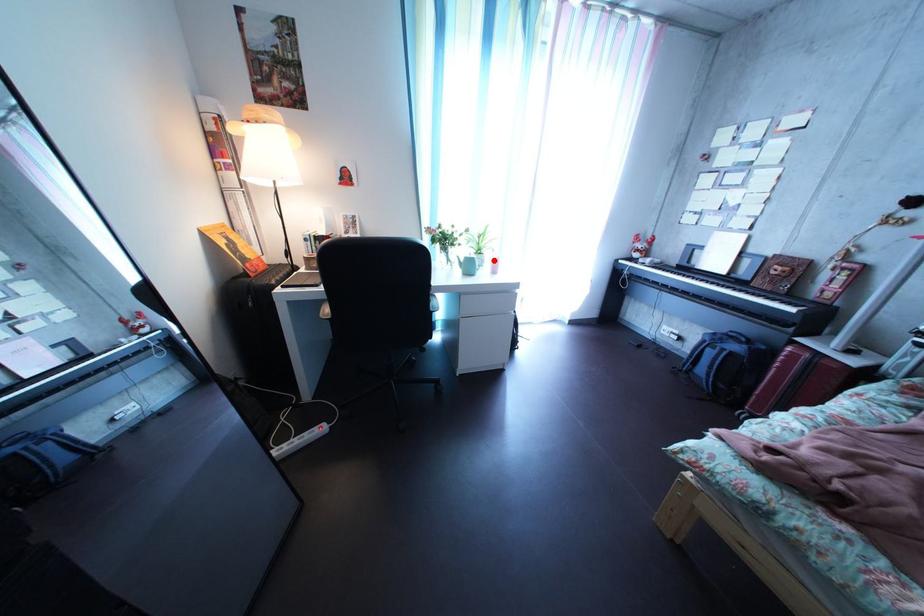
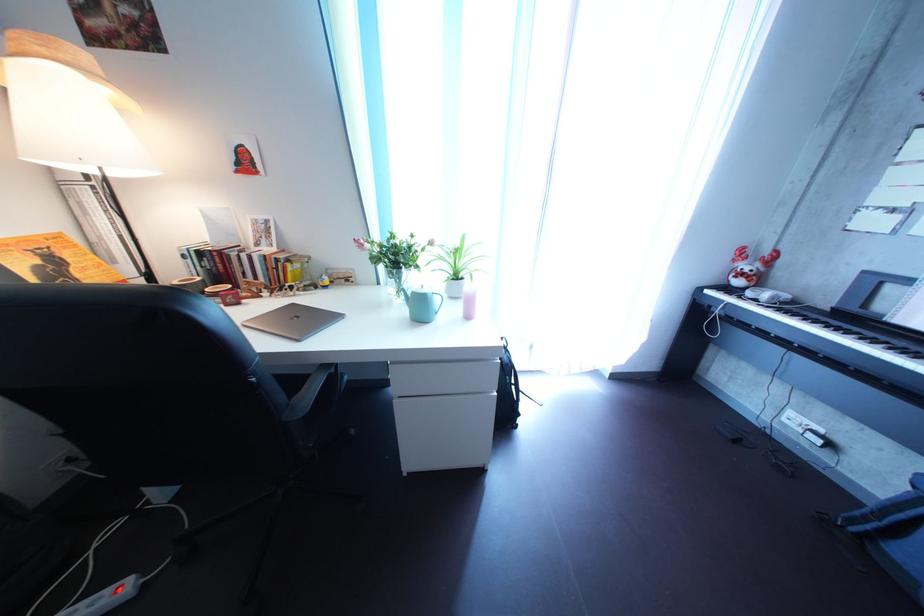
Find the pixel in the second image that matches the highlighted location in the first image.

(469, 285)